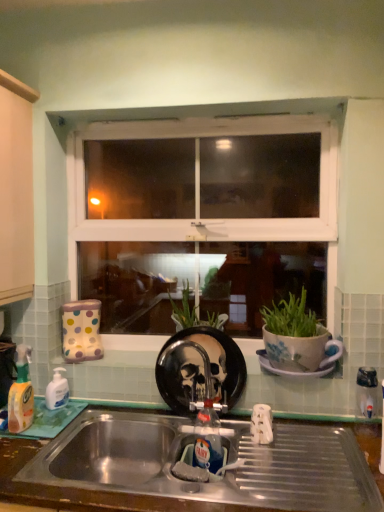
The height and width of the screenshot is (512, 384). I want to click on empty space that is ontop of white plastic window at center (from a real-world perspective), so click(213, 117).